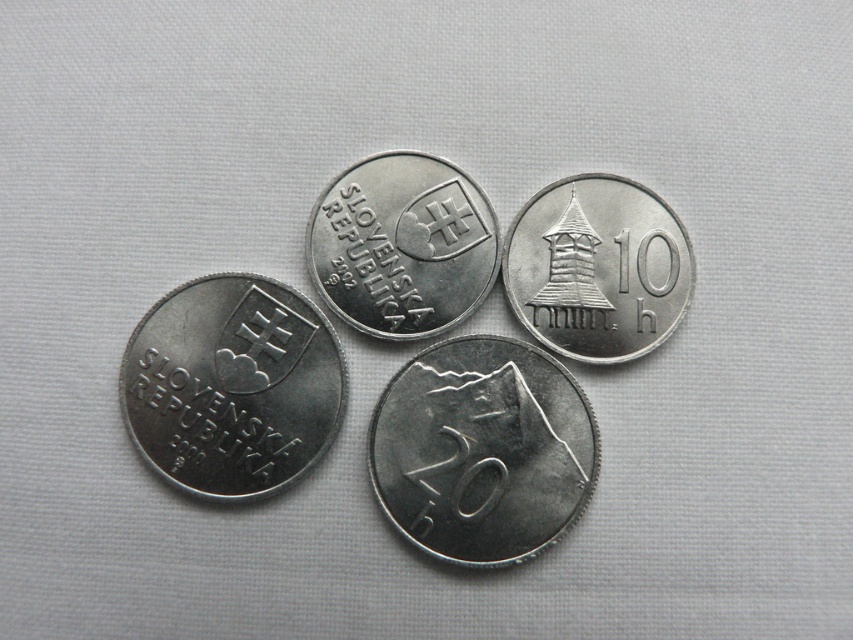
Question: Observing the image, what is the correct spatial positioning of silver metallic mountain at center in reference to silver metallic tower at upper right?

Choices:
 (A) left
 (B) right

Answer: (A)

Question: Which object appears closest to the camera in this image?

Choices:
 (A) silver metallic coin at center
 (B) silver metallic coin at lower left

Answer: (B)

Question: Which object appears farthest from the camera in this image?

Choices:
 (A) silver metallic tower at upper right
 (B) silver metallic coin at lower left

Answer: (A)

Question: Which point appears closest to the camera in this image?

Choices:
 (A) (427, 282)
 (B) (643, 230)
 (C) (418, 545)
 (D) (292, 292)

Answer: (C)

Question: Is silver metallic coin at lower left smaller than silver metallic tower at upper right?

Choices:
 (A) no
 (B) yes

Answer: (A)

Question: Is silver metallic mountain at center wider than silver metallic tower at upper right?

Choices:
 (A) yes
 (B) no

Answer: (A)